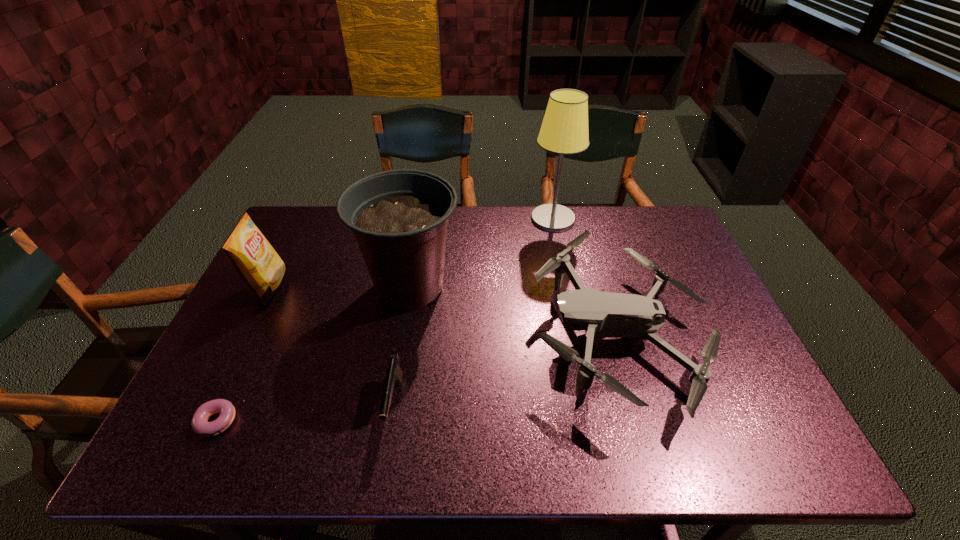
Where is `free space between the flowerpot and the tallest object`? Image resolution: width=960 pixels, height=540 pixels. free space between the flowerpot and the tallest object is located at coordinates (481, 253).

At what (x,y) coordinates should I click in order to perform the action: click on free spot between the second shortest object and the second tallest object. Please return your answer as a coordinate pair (x, y). Image resolution: width=960 pixels, height=540 pixels. Looking at the image, I should click on (402, 346).

This screenshot has height=540, width=960. Find the location of `vacant area that lies between the farthest object and the fifth tallest object`. vacant area that lies between the farthest object and the fifth tallest object is located at coordinates (474, 312).

At what (x,y) coordinates should I click in order to perform the action: click on vacant point located between the table lamp and the pistol. Please return your answer as a coordinate pair (x, y). The width and height of the screenshot is (960, 540). Looking at the image, I should click on (474, 312).

Identify the location of vacant space that's between the table lamp and the fourth tallest object. (584, 277).

This screenshot has width=960, height=540. I want to click on unoccupied area between the fourth shortest object and the third shortest object, so click(x=442, y=311).

The image size is (960, 540). I want to click on blank region between the fourth tallest object and the flowerpot, so click(x=513, y=311).

Locate which object is the fifth closest to the second shortest object. Please provide its 2D coordinates. Your answer should be formatted as a tuple, i.e. [(x, y)], where the tuple contains the x and y coordinates of a point satisfying the conditions above.

[(564, 130)]

Identify the location of object that can be found as the third closest to the pistol. (200, 426).

Locate an element on the screen. The height and width of the screenshot is (540, 960). blank space that satisfies the following two spatial constraints: 1. on the back side of the doughnut; 2. on the right side of the second tallest object is located at coordinates (281, 287).